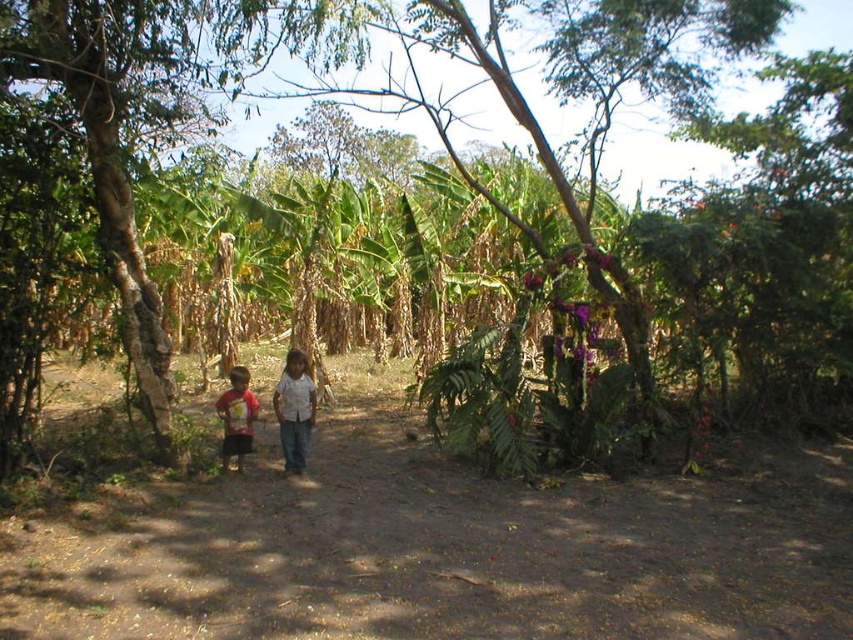
Question: Is brown dirt path at center in front of red t-shirt at left?

Choices:
 (A) yes
 (B) no

Answer: (A)

Question: Does brown dirt path at center appear on the left side of red t-shirt at left?

Choices:
 (A) no
 (B) yes

Answer: (B)

Question: Does brown dirt path at center have a greater width compared to red t-shirt at left?

Choices:
 (A) no
 (B) yes

Answer: (A)

Question: Which object is positioned closest to the white cotton shirt at center?

Choices:
 (A) brown dirt path at center
 (B) red t-shirt at left

Answer: (B)

Question: Among these points, which one is farthest from the camera?

Choices:
 (A) (207, 627)
 (B) (244, 397)
 (C) (291, 358)

Answer: (C)

Question: Which of these objects is positioned closest to the red t-shirt at left?

Choices:
 (A) brown dirt path at center
 (B) white cotton shirt at center

Answer: (B)